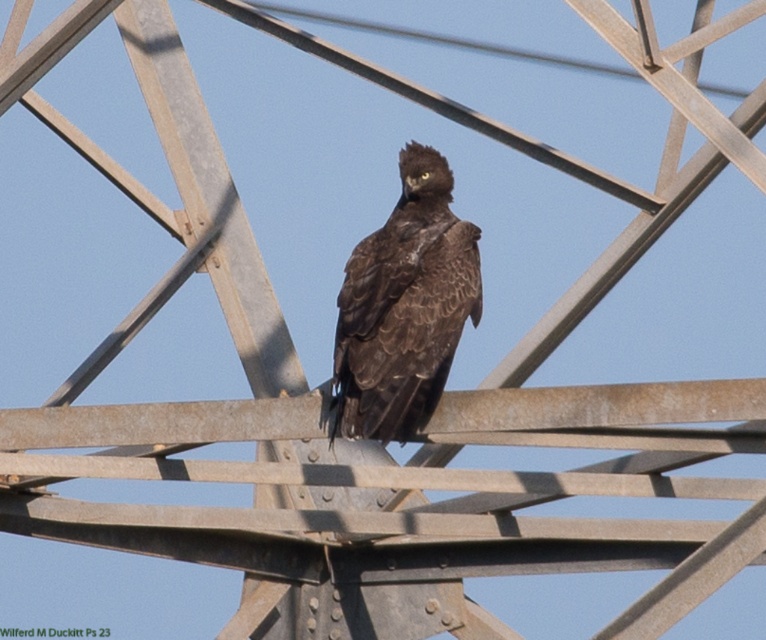
Question: Which point is farther to the camera?

Choices:
 (A) brushed metal power line at upper center
 (B) brown feathered eagle at center

Answer: (A)

Question: Where is brown feathered eagle at center located in relation to brushed metal power line at upper center in the image?

Choices:
 (A) above
 (B) below

Answer: (B)

Question: Is brown feathered eagle at center below brushed metal power line at upper center?

Choices:
 (A) no
 (B) yes

Answer: (B)

Question: Does brown feathered eagle at center appear under brushed metal power line at upper center?

Choices:
 (A) yes
 (B) no

Answer: (A)